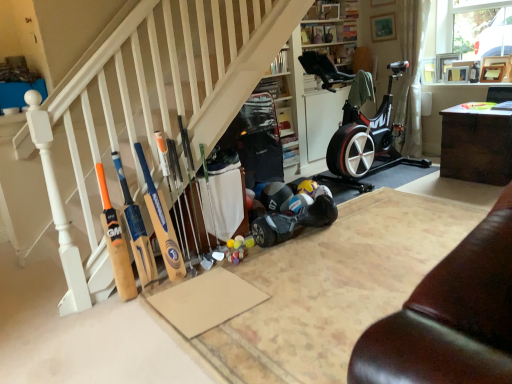
This screenshot has height=384, width=512. What are the coordinates of `free point in front of wooden bat at left, placed as the first baseball bat when sorted from left to right` in the screenshot? It's located at (115, 319).